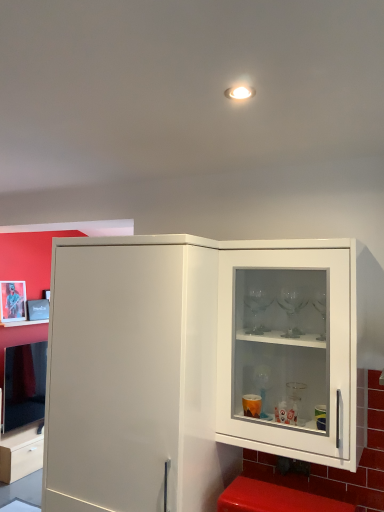
The height and width of the screenshot is (512, 384). What do you see at coordinates (274, 499) in the screenshot?
I see `red plastic step stool at lower right` at bounding box center [274, 499].

Measure the distance between point [19,301] and camera.

Point [19,301] is 4.48 meters from camera.

Find the location of a particular element. The height and width of the screenshot is (512, 384). metallic silver picture frame at upper left is located at coordinates (13, 301).

Identify the location of white glossy cabinet door at center. This screenshot has height=512, width=384. (113, 377).

Locate an element on the screen. The width and height of the screenshot is (384, 512). red plastic step stool at lower right is located at coordinates click(274, 499).

Is red plastic step stool at lower right at the back of white glossy cabinet at right?

white glossy cabinet at right does not have its back to red plastic step stool at lower right.

From the image's perspective, is white glossy cabinet at right beneath red plastic step stool at lower right?

No, from the image's perspective, white glossy cabinet at right is not below red plastic step stool at lower right.

From a real-world perspective, which is physically below, white glossy cabinet at right or red plastic step stool at lower right?

red plastic step stool at lower right, from a real-world perspective.

From a real-world perspective, is white glossy cabinet at right beneath white glossy cabinet door at center?

No.

Which object is positioned more to the right, white glossy cabinet at right or white glossy cabinet door at center?

white glossy cabinet at right is more to the right.

Considering the relative sizes of white glossy cabinet at right and white glossy cabinet door at center in the image provided, is white glossy cabinet at right thinner than white glossy cabinet door at center?

Yes, white glossy cabinet at right is thinner than white glossy cabinet door at center.

Where is `door that is below the white glossy cabinet at right (from the image's perspective)`? door that is below the white glossy cabinet at right (from the image's perspective) is located at coordinates (113, 377).

From the image's perspective, is white glossy cabinet door at center beneath white glossy cabinet at right?

Correct, white glossy cabinet door at center appears lower than white glossy cabinet at right in the image.

Is white glossy cabinet door at center in contact with white glossy cabinet at right?

No, white glossy cabinet door at center is not with white glossy cabinet at right.

In the image, is metallic silver picture frame at upper left positioned in front of or behind white glossy cabinet door at center?

metallic silver picture frame at upper left is positioned farther from the viewer than white glossy cabinet door at center.

Which is nearer, (21, 306) or (135, 369)?

Point (21, 306) appears to be farther away from the viewer than point (135, 369).

From a real-world perspective, is metallic silver picture frame at upper left above or below white glossy cabinet door at center?

In terms of real-world spatial position, metallic silver picture frame at upper left is above white glossy cabinet door at center.

From the image's perspective, is red plastic step stool at lower right above metallic silver picture frame at upper left?

Actually, red plastic step stool at lower right appears below metallic silver picture frame at upper left in the image.

Between red plastic step stool at lower right and metallic silver picture frame at upper left, which one has larger width?

red plastic step stool at lower right is wider.

Can you confirm if red plastic step stool at lower right is positioned to the left of metallic silver picture frame at upper left?

No, red plastic step stool at lower right is not to the left of metallic silver picture frame at upper left.

From a real-world perspective, relative to metallic silver picture frame at upper left, is red plastic step stool at lower right vertically above or below?

In terms of real-world spatial position, red plastic step stool at lower right is below metallic silver picture frame at upper left.

Is red plastic step stool at lower right aimed at white glossy cabinet at right?

No, red plastic step stool at lower right is not oriented towards white glossy cabinet at right.

From a real-world perspective, who is located lower, red plastic step stool at lower right or white glossy cabinet at right?

red plastic step stool at lower right, from a real-world perspective.

Is red plastic step stool at lower right to the right of white glossy cabinet at right from the viewer's perspective?

In fact, red plastic step stool at lower right is to the left of white glossy cabinet at right.

Which is correct: red plastic step stool at lower right is inside white glossy cabinet at right, or outside of it?

The correct answer is: outside.

From the image's perspective, which one is positioned higher, white glossy cabinet at right or metallic silver picture frame at upper left?

white glossy cabinet at right is shown above in the image.

Between white glossy cabinet at right and metallic silver picture frame at upper left, which one is positioned in front?

white glossy cabinet at right is more forward.

Is metallic silver picture frame at upper left located within white glossy cabinet at right?

No, metallic silver picture frame at upper left is not inside white glossy cabinet at right.

Is white glossy cabinet at right at the left side of metallic silver picture frame at upper left?

Incorrect, white glossy cabinet at right is not on the left side of metallic silver picture frame at upper left.

This screenshot has height=512, width=384. Find the location of `cupboard that appears above the red plastic step stool at lower right (from the image's perspective)`. cupboard that appears above the red plastic step stool at lower right (from the image's perspective) is located at coordinates (290, 350).

Find the location of a particular element. This screenshot has width=384, height=512. cupboard above the white glossy cabinet door at center (from a real-world perspective) is located at coordinates (290, 350).

From the picture: Based on their spatial positions, is white glossy cabinet door at center or metallic silver picture frame at upper left further from white glossy cabinet at right?

metallic silver picture frame at upper left is further to white glossy cabinet at right.

When comparing their distances from metallic silver picture frame at upper left, does white glossy cabinet at right or red plastic step stool at lower right seem further?

red plastic step stool at lower right lies further to metallic silver picture frame at upper left than the other object.

Considering their positions, is white glossy cabinet at right positioned closer to red plastic step stool at lower right than white glossy cabinet door at center?

Among the two, white glossy cabinet at right is located nearer to red plastic step stool at lower right.

Estimate the real-world distances between objects in this image. Which object is closer to metallic silver picture frame at upper left, red plastic step stool at lower right or white glossy cabinet door at center?

Based on the image, white glossy cabinet door at center appears to be nearer to metallic silver picture frame at upper left.

Estimate the real-world distances between objects in this image. Which object is closer to white glossy cabinet door at center, white glossy cabinet at right or metallic silver picture frame at upper left?

white glossy cabinet at right lies closer to white glossy cabinet door at center than the other object.

Which object lies nearer to the anchor point red plastic step stool at lower right, metallic silver picture frame at upper left or white glossy cabinet at right?

Among the two, white glossy cabinet at right is located nearer to red plastic step stool at lower right.

From the image, which object appears to be farther from metallic silver picture frame at upper left, red plastic step stool at lower right or white glossy cabinet at right?

red plastic step stool at lower right is further to metallic silver picture frame at upper left.

Estimate the real-world distances between objects in this image. Which object is closer to white glossy cabinet door at center, white glossy cabinet at right or red plastic step stool at lower right?

white glossy cabinet at right is positioned closer to the anchor white glossy cabinet door at center.

Identify the location of cupboard between red plastic step stool at lower right and metallic silver picture frame at upper left in the front-back direction. This screenshot has width=384, height=512. (290, 350).

Locate an element on the screen. The width and height of the screenshot is (384, 512). door located between red plastic step stool at lower right and metallic silver picture frame at upper left in the depth direction is located at coordinates (113, 377).

This screenshot has height=512, width=384. In order to click on door between white glossy cabinet at right and red plastic step stool at lower right in the up-down direction in this screenshot , I will do `click(113, 377)`.

Find the location of `cupboard located between white glossy cabinet door at center and metallic silver picture frame at upper left in the depth direction`. cupboard located between white glossy cabinet door at center and metallic silver picture frame at upper left in the depth direction is located at coordinates (290, 350).